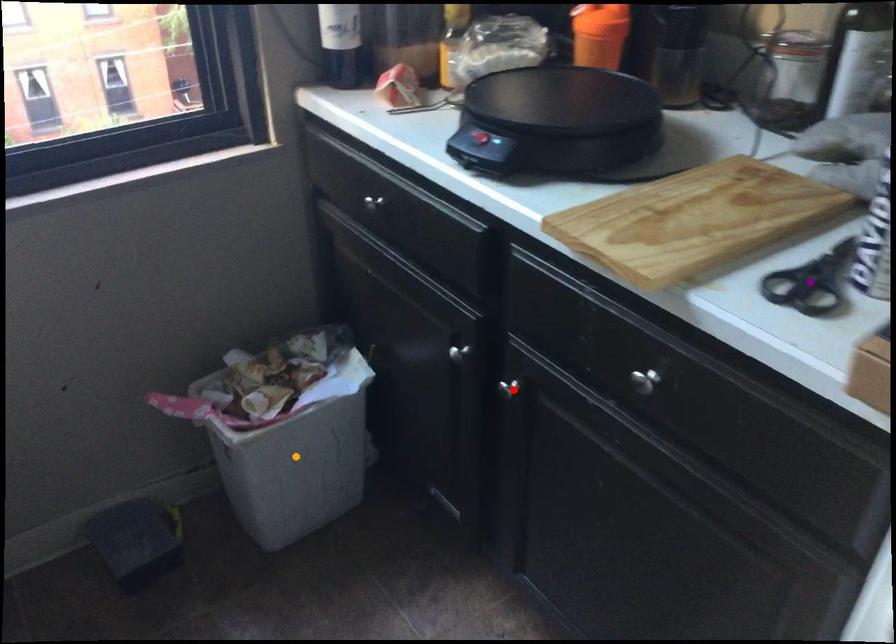
Order these from nearest to farthest:
A) red point
B) purple point
C) orange point

orange point
red point
purple point